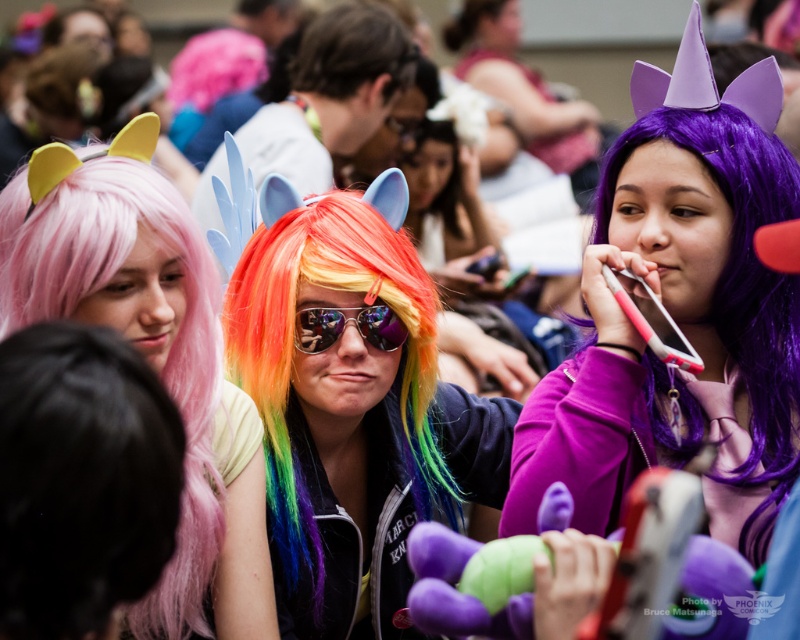
You are a photographer at the event and want to capture a photo where both the pink fluffy wig at lower left and the blonde hair at upper center are visible. Which object should you ensure is closer to the camera to avoid it being blocked by the other?

The pink fluffy wig at lower left is smaller in size compared to the blonde hair at upper center. To ensure both are visible, you should position the pink fluffy wig at lower left closer to the camera so its smaller size doesn

You are a photographer at the event and need to position the rainbow wig at center and the blonde hair at upper center in your shot. Which of the two has a larger size?

The rainbow wig at center is bigger than the blonde hair at upper center.